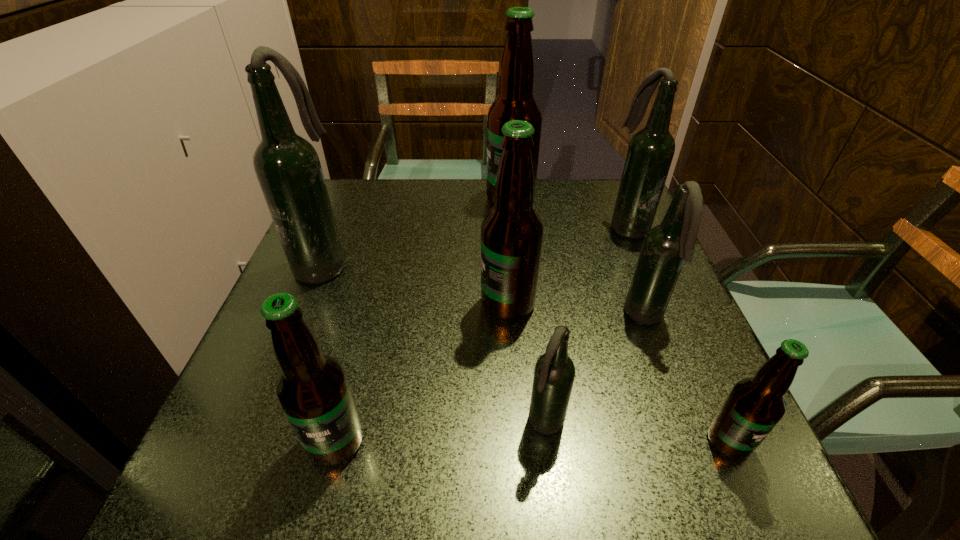
Where is `the smallest dark beer bottle`? the smallest dark beer bottle is located at coordinates (554, 374).

Where is `the nearest dark beer bottle`? The image size is (960, 540). the nearest dark beer bottle is located at coordinates (554, 374).

Where is `the rightmost brown beer bottle`? This screenshot has width=960, height=540. the rightmost brown beer bottle is located at coordinates (754, 406).

At what (x,y) coordinates should I click in order to perform the action: click on free space located on the label of the biggest brown beer bottle. Please return your answer as a coordinate pair (x, y). The image size is (960, 540). Looking at the image, I should click on (360, 199).

Locate an element on the screen. This screenshot has width=960, height=540. vacant space situated on the label of the biggest brown beer bottle is located at coordinates (342, 199).

I want to click on vacant position located 0.160m on the label of the biggest brown beer bottle, so click(x=427, y=199).

The image size is (960, 540). Identify the location of vacant space located on the back of the leftmost beer bottle. (339, 222).

Image resolution: width=960 pixels, height=540 pixels. What are the coordinates of `vacant space situated on the front of the seventh nearest beer bottle` in the screenshot? It's located at (647, 271).

The width and height of the screenshot is (960, 540). What are the coordinates of `blank area located 0.260m on the label of the third nearest brown beer bottle` in the screenshot? It's located at (352, 304).

The height and width of the screenshot is (540, 960). I want to click on free space located 0.120m on the label of the third nearest brown beer bottle, so click(x=421, y=304).